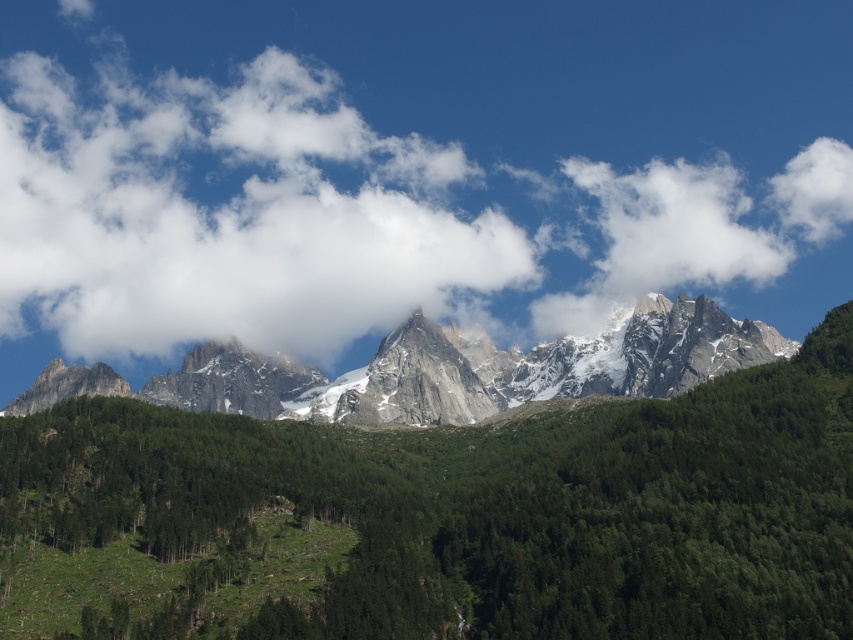
You are an airplane pilot flying over the mountainous landscape. You notice a white fluffy cloud at upper center and a green matte tree at center. Which object is positioned to the left when viewing from your perspective?

The white fluffy cloud at upper center is to the left of the green matte tree at center, so the white fluffy cloud at upper center is positioned to the left.

You are a hiker planning to take a photo of the white fluffy cloud at upper center from the base of the mountain. If the mountain is 1000 feet tall, can you see the cloud from the base?

The white fluffy cloud at upper center is 1149.03 feet away from the mountain. Since the mountain is 1000 feet tall, the cloud is higher than the mountain, so you can see it from the base.

You are an airplane pilot flying at a high altitude. You notice a white fluffy cloud at upper center and a green matte tree at center below you. Which object is closer to your current position?

The white fluffy cloud at upper center is closer to your current position because it is further to the viewer than the green matte tree at center.